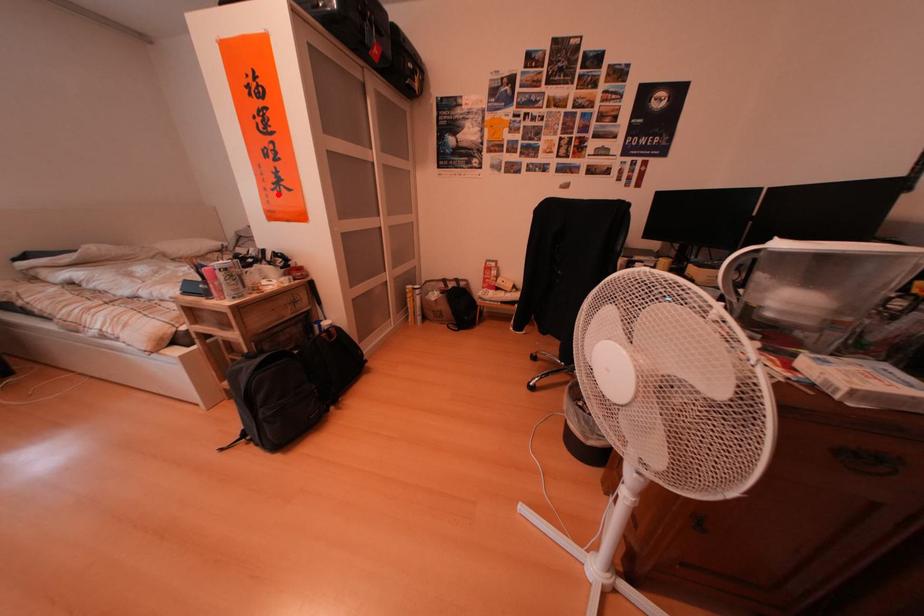
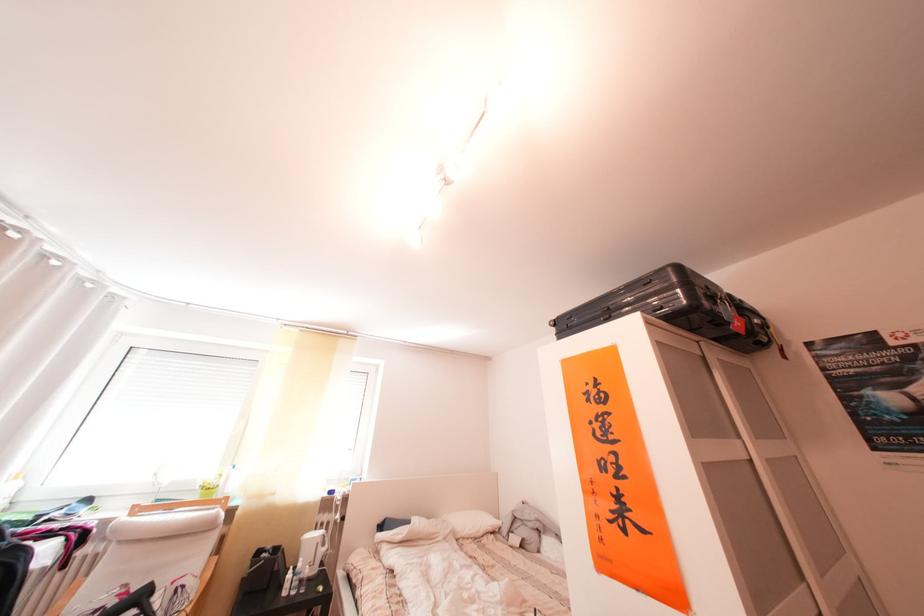
Find the pixel in the second image that matches the highlighted location in the first image.

(610, 522)